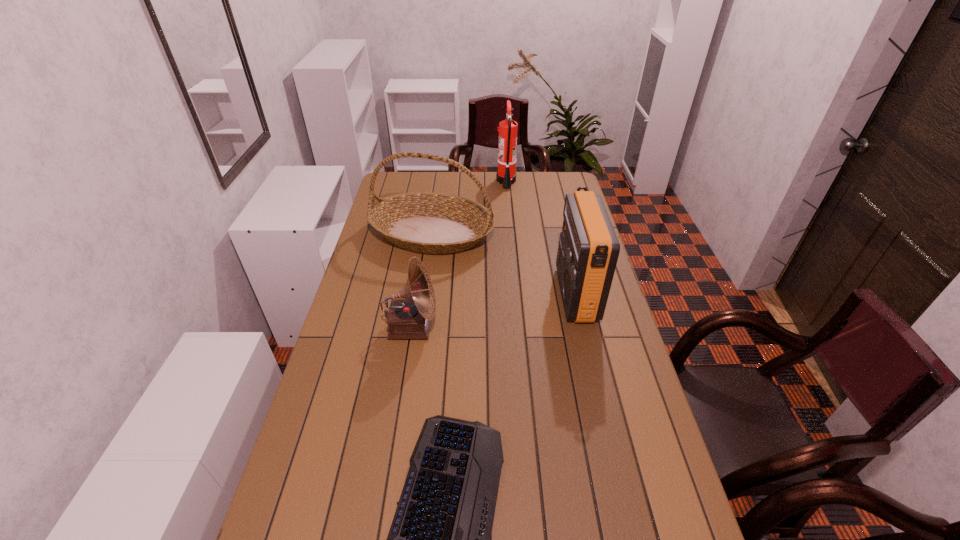
Find the location of `the farthest object`. the farthest object is located at coordinates (506, 175).

Where is `fire extinguisher`? The image size is (960, 540). fire extinguisher is located at coordinates (506, 175).

Find the location of a particular element. The height and width of the screenshot is (540, 960). basket is located at coordinates (425, 222).

Locate an element on the screen. radio receiver is located at coordinates (588, 250).

This screenshot has width=960, height=540. Find the location of `the fourth tallest object`. the fourth tallest object is located at coordinates click(409, 318).

At what (x,y) coordinates should I click in order to perform the action: click on free region located 0.060m at the nozzle of the farthest object. Please return your answer as a coordinate pair (x, y). Looking at the image, I should click on (484, 181).

Identify the location of free location located 0.150m at the nozzle of the farthest object. (466, 181).

Find the location of a particular element. This screenshot has width=960, height=540. vacant space located at the nozzle of the farthest object is located at coordinates (484, 181).

The width and height of the screenshot is (960, 540). Identify the location of free space located 0.270m on the back of the basket. (440, 179).

Where is `free region located on the front-facing side of the rightmost object`? The height and width of the screenshot is (540, 960). free region located on the front-facing side of the rightmost object is located at coordinates (530, 294).